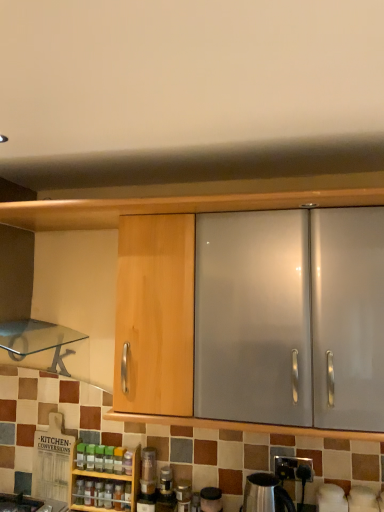
Question: Does white glossy kettle at lower right, which ranks as the 3th appliance in left-to-right order, have a greater width compared to translucent plastic bottles at center, the first bottle in the left-to-right sequence?

Choices:
 (A) yes
 (B) no

Answer: (A)

Question: Is translucent plastic bottles at center, which ranks as the eighth bottle in right-to-left order, located within white glossy kettle at lower right, which ranks as the 3th appliance in left-to-right order?

Choices:
 (A) yes
 (B) no

Answer: (B)

Question: Is white glossy kettle at lower right, which ranks as the 3th appliance in left-to-right order, smaller than translucent plastic bottles at center, which ranks as the eighth bottle in right-to-left order?

Choices:
 (A) yes
 (B) no

Answer: (B)

Question: Considering the relative sizes of white glossy kettle at lower right, which ranks as the 3th appliance in left-to-right order, and translucent plastic bottles at center, which ranks as the eighth bottle in right-to-left order, in the image provided, is white glossy kettle at lower right, which ranks as the 3th appliance in left-to-right order, taller than translucent plastic bottles at center, which ranks as the eighth bottle in right-to-left order,?

Choices:
 (A) no
 (B) yes

Answer: (B)

Question: Considering the relative positions of white glossy kettle at lower right, which appears as the 1th appliance when viewed from the right, and translucent plastic bottles at center, which ranks as the eighth bottle in right-to-left order, in the image provided, is white glossy kettle at lower right, which appears as the 1th appliance when viewed from the right, to the left of translucent plastic bottles at center, which ranks as the eighth bottle in right-to-left order, from the viewer's perspective?

Choices:
 (A) yes
 (B) no

Answer: (B)

Question: Which is correct: green plastic bottle at center, which is the 6th bottle in right-to-left order, is inside translucent glass jar at lower center, which is the first bottle in right-to-left order, or outside of it?

Choices:
 (A) inside
 (B) outside

Answer: (B)

Question: Is green plastic bottle at center, which is the 3th bottle from left to right, in front of or behind translucent glass jar at lower center, which is the eighth bottle from left to right, in the image?

Choices:
 (A) front
 (B) behind

Answer: (B)

Question: Is point (97, 445) positioned closer to the camera than point (188, 509)?

Choices:
 (A) closer
 (B) farther

Answer: (B)

Question: Based on their sizes in the image, would you say green plastic bottle at center, which is the 6th bottle in right-to-left order, is bigger or smaller than translucent glass jar at lower center, which is the first bottle in right-to-left order?

Choices:
 (A) small
 (B) big

Answer: (A)

Question: Is green plastic bottle at center, which is the 6th bottle in right-to-left order, spatially inside translucent plastic spice bottle at lower left, the 5th bottle in the left-to-right sequence, or outside of it?

Choices:
 (A) inside
 (B) outside

Answer: (B)

Question: Considering the positions of green plastic bottle at center, which is the 3th bottle from left to right, and translucent plastic spice bottle at lower left, the 5th bottle in the left-to-right sequence, in the image, is green plastic bottle at center, which is the 3th bottle from left to right, taller or shorter than translucent plastic spice bottle at lower left, the 5th bottle in the left-to-right sequence,?

Choices:
 (A) tall
 (B) short

Answer: (B)

Question: Based on their positions, is green plastic bottle at center, which is the 6th bottle in right-to-left order, located to the left or right of translucent plastic spice bottle at lower left, the fourth bottle positioned from the right?

Choices:
 (A) left
 (B) right

Answer: (A)

Question: Considering the positions of point (100, 464) and point (104, 489), is point (100, 464) closer or farther from the camera than point (104, 489)?

Choices:
 (A) closer
 (B) farther

Answer: (B)

Question: Is translucent plastic bottle at center, the third bottle positioned from the right, wider or thinner than green plastic bottle at center, which is the 3th bottle from left to right?

Choices:
 (A) wide
 (B) thin

Answer: (A)

Question: Is translucent plastic bottle at center, the third bottle positioned from the right, taller or shorter than green plastic bottle at center, which is the 3th bottle from left to right?

Choices:
 (A) short
 (B) tall

Answer: (A)